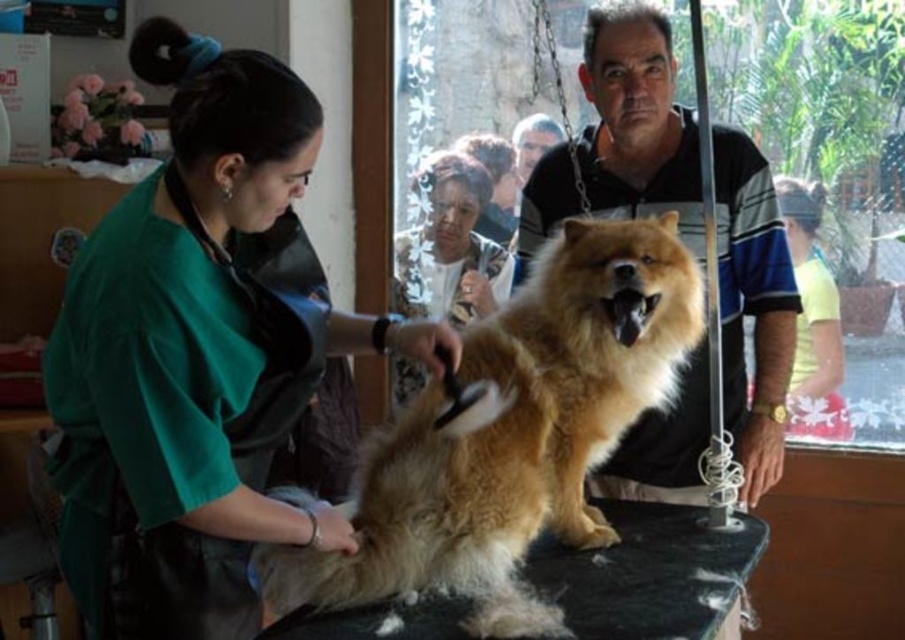
You are a photographer trying to capture a closeup of the fluffy brown fur at center without including the green fabric shirt at upper left in the frame. Can you adjust your camera angle to achieve this?

The green fabric shirt at upper left is wider than the fluffy brown fur at center, so adjusting the camera angle might help exclude the green fabric shirt at upper left while focusing on the fluffy brown fur at center.

You are a photographer positioned to the side of the grooming area. You want to capture a photo that includes both the green fabric shirt at upper left and the fluffy brown fur at center. Which object should you adjust your camera angle to prioritize if you want to ensure both are fully visible in the frame?

The green fabric shirt at upper left is taller than the fluffy brown fur at center, so you should prioritize adjusting your camera angle to accommodate the height of the green fabric shirt at upper left to ensure both are fully visible.